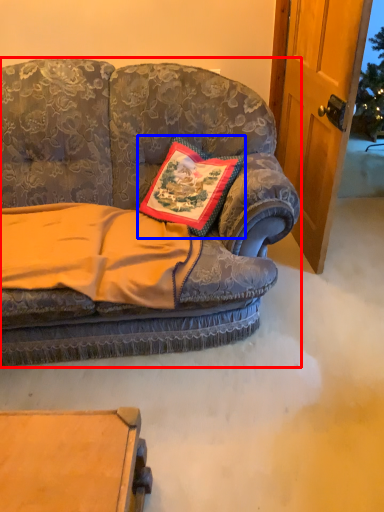
Question: Which object appears farthest to the camera in this image, studio couch (highlighted by a red box) or pillow (highlighted by a blue box)?

Choices:
 (A) studio couch
 (B) pillow

Answer: (B)